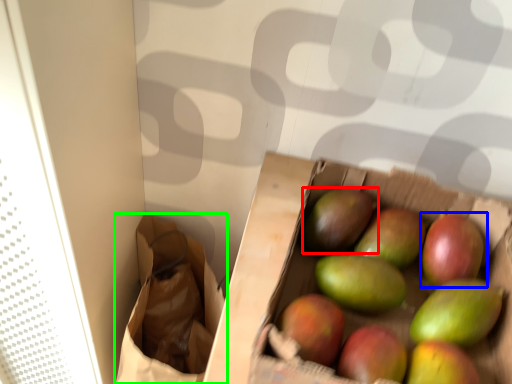
Question: Considering the real-world distances, which object is closest to mango (highlighted by a red box)? grapefruit (highlighted by a blue box) or shopping bag (highlighted by a green box).

Choices:
 (A) grapefruit
 (B) shopping bag

Answer: (A)